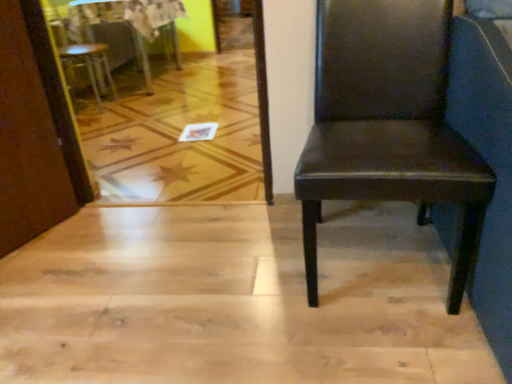
In order to click on vacant region to the left of matte brown leather chair at right, placed as the 2th chair when sorted from top to bottom in this screenshot , I will do `click(229, 270)`.